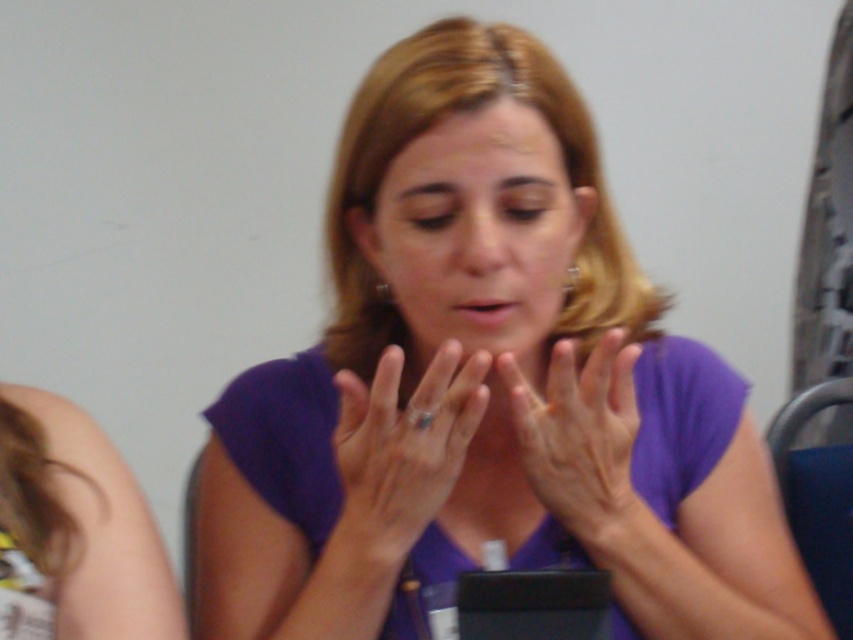
Can you confirm if purple matte shirt at center is positioned below purple matte face at center?

Yes, purple matte shirt at center is below purple matte face at center.

Who is positioned more to the right, purple matte shirt at center or purple matte face at center?

From the viewer's perspective, purple matte face at center appears more on the right side.

Describe the element at coordinates (486, 387) in the screenshot. This screenshot has height=640, width=853. I see `purple matte shirt at center` at that location.

The image size is (853, 640). In order to click on purple matte shirt at center in this screenshot , I will do `click(486, 387)`.

Who is positioned more to the left, purple matte shirt at center or dry skin hands at center?

Positioned to the left is purple matte shirt at center.

Consider the image. Who is taller, purple matte shirt at center or dry skin hands at center?

purple matte shirt at center

Who is more distant from viewer, (x=247, y=547) or (x=590, y=472)?

The point (x=247, y=547) is more distant.

I want to click on purple matte shirt at center, so click(486, 387).

Is the position of purple matte face at center more distant than that of matte gold ring at center?

Yes.

Can you confirm if purple matte face at center is bigger than matte gold ring at center?

Correct, purple matte face at center is larger in size than matte gold ring at center.

Describe the element at coordinates (477, 230) in the screenshot. I see `purple matte face at center` at that location.

At what (x,y) coordinates should I click in order to perform the action: click on purple matte face at center. Please return your answer as a coordinate pair (x, y). Looking at the image, I should click on (477, 230).